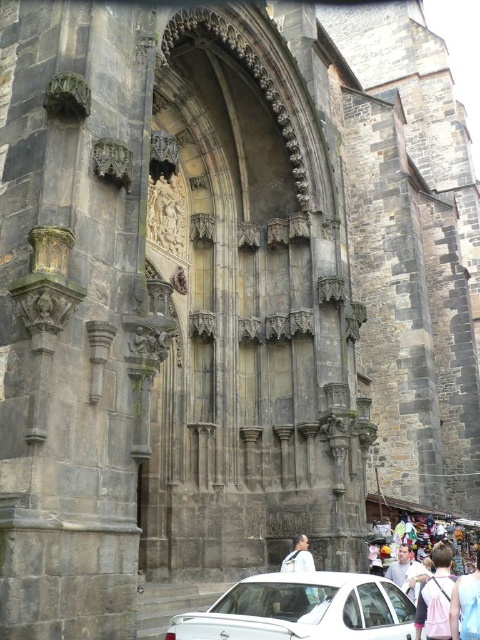
Which is more to the left, pink fabric at center or light pink fabric at lower right?

From the viewer's perspective, pink fabric at center appears more on the left side.

Can you confirm if pink fabric at center is positioned to the right of light pink fabric at lower right?

In fact, pink fabric at center is to the left of light pink fabric at lower right.

What do you see at coordinates (435, 596) in the screenshot? This screenshot has height=640, width=480. I see `pink fabric at center` at bounding box center [435, 596].

Locate an element on the screen. This screenshot has height=640, width=480. pink fabric at center is located at coordinates (435, 596).

Who is lower down, pink fabric at center or white matte shirt at center?

Positioned lower is pink fabric at center.

Between pink fabric at center and white matte shirt at center, which one has less height?

white matte shirt at center is shorter.

Does point (440, 593) come closer to viewer compared to point (311, 589)?

That is False.

Identify the location of pink fabric at center. The image size is (480, 640). [x=435, y=596].

The height and width of the screenshot is (640, 480). What do you see at coordinates (302, 609) in the screenshot?
I see `white glossy car at lower center` at bounding box center [302, 609].

Can you confirm if white glossy car at lower center is positioned to the left of white matte shirt at center?

Yes, white glossy car at lower center is to the left of white matte shirt at center.

Where is `white glossy car at lower center`? white glossy car at lower center is located at coordinates (302, 609).